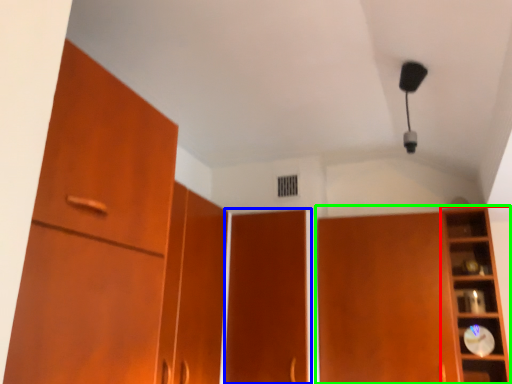
Question: Estimate the real-world distances between objects in this image. Which object is closer to shelf (highlighted by a red box), door (highlighted by a blue box) or cupboard (highlighted by a green box)?

Choices:
 (A) door
 (B) cupboard

Answer: (B)